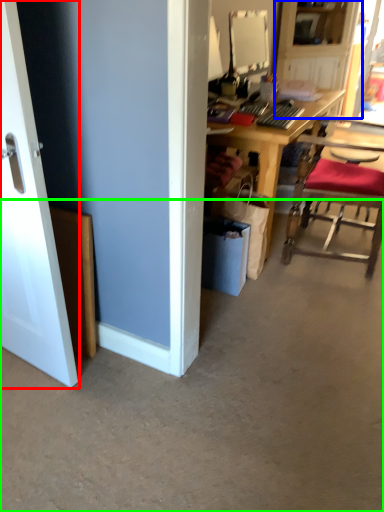
Question: Which object is the farthest from door (highlighted by a red box)? Choose among these: dresser (highlighted by a blue box) or concrete (highlighted by a green box).

Choices:
 (A) dresser
 (B) concrete

Answer: (A)